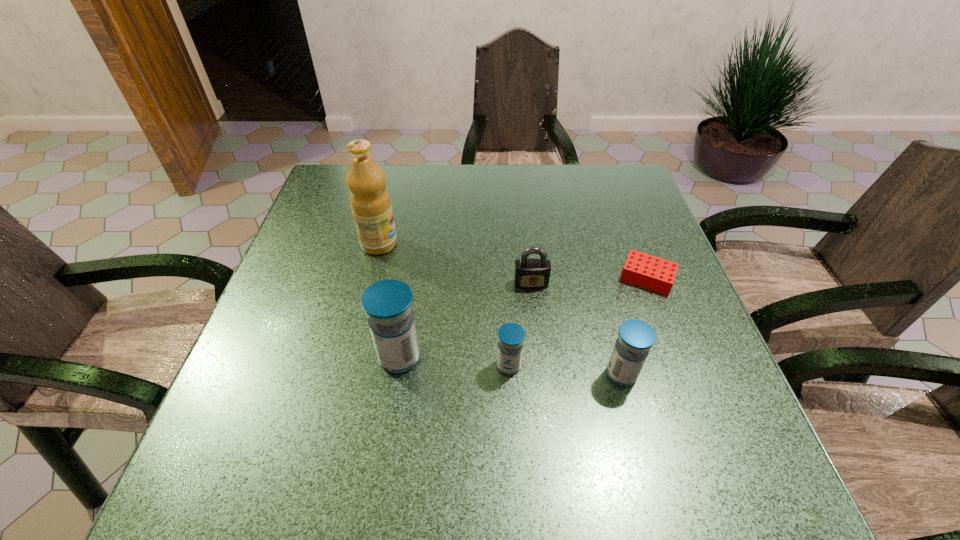
The height and width of the screenshot is (540, 960). What are the coordinates of `free space for a new medicine on the left` in the screenshot? It's located at (294, 349).